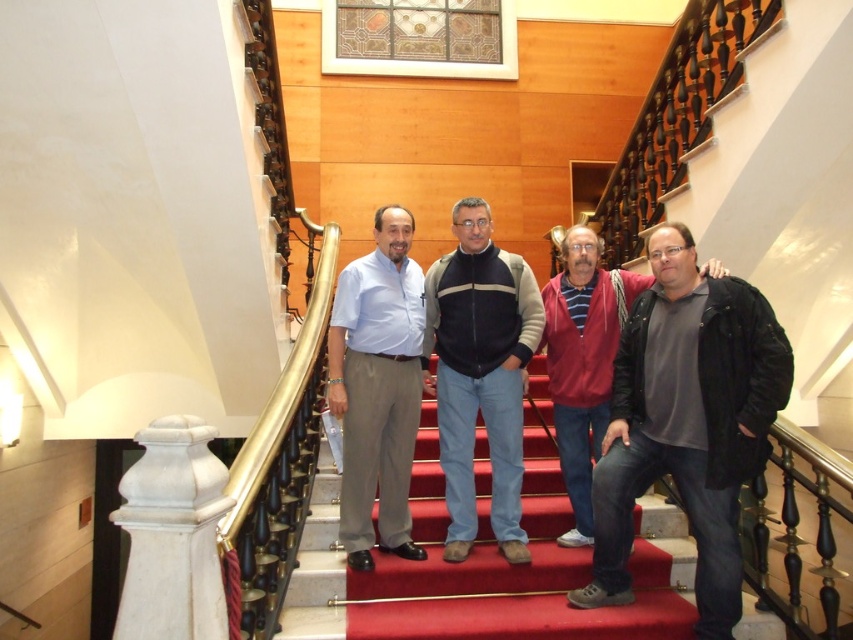
You are standing at the bottom of the staircase and looking up. There are two points marked on the staircase, one at coordinates point (387, 563) and another at point (338, 417). Which point is higher up the staircase?

Point (338, 417) is higher up the staircase because it is farther from the camera compared to point (387, 563), which is closer to the camera.